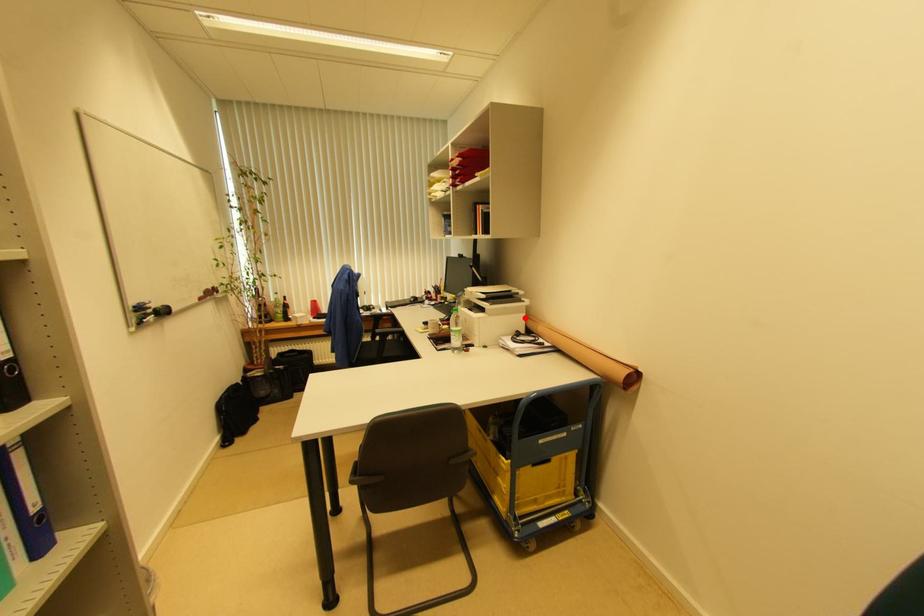
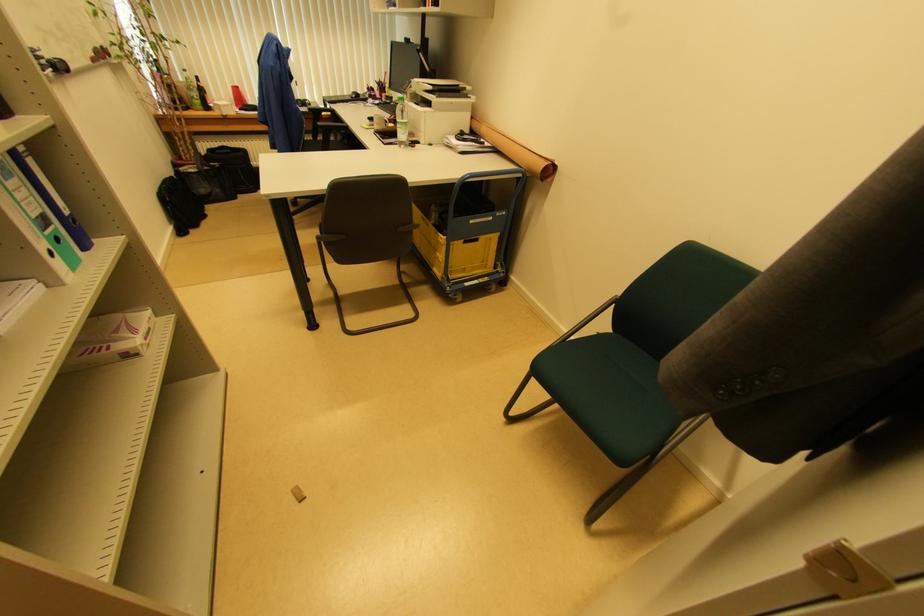
Question: I am providing you with two images of the same scene from different viewpoints. Given a red point in image1, look at the same physical point in image2. Is it:

Choices:
 (A) Closer to the viewpoint
 (B) Farther from the viewpoint

Answer: (A)